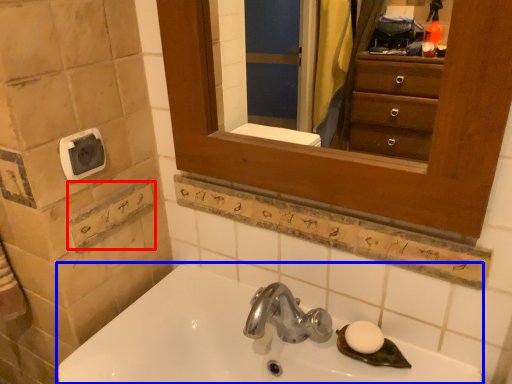
Question: Among these objects, which one is farthest to the camera, square (highlighted by a red box) or sink (highlighted by a blue box)?

Choices:
 (A) square
 (B) sink

Answer: (A)